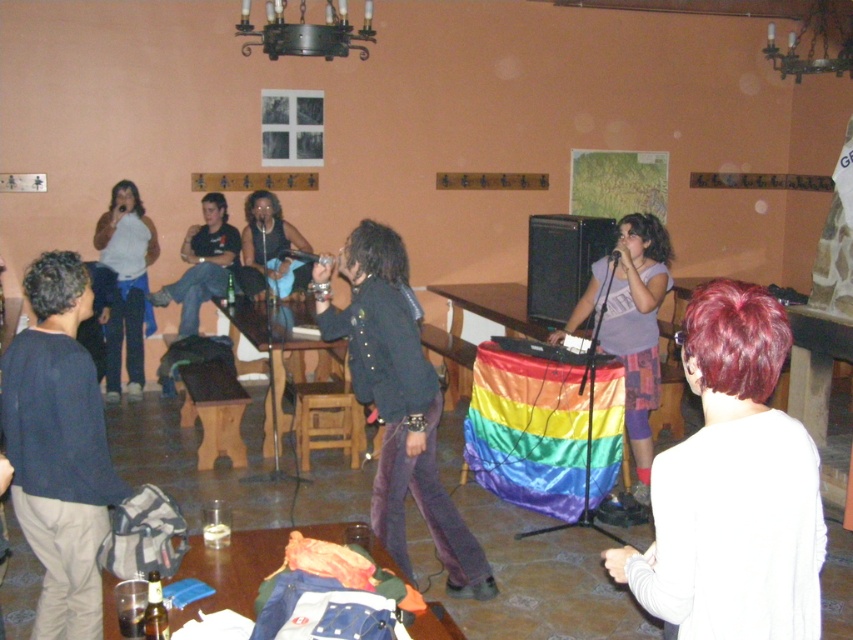
Question: Which point is farther to the camera?

Choices:
 (A) (631, 316)
 (B) (772, 538)
 (C) (51, 621)

Answer: (A)

Question: Which object appears farthest from the camera in this image?

Choices:
 (A) dark blue jeans at center
 (B) rainbow fabric dj booth at center
 (C) dark blue sweater at left

Answer: (A)

Question: Considering the relative positions of dark blue sweater at left and dark blue jeans at center in the image provided, where is dark blue sweater at left located with respect to dark blue jeans at center?

Choices:
 (A) above
 (B) below

Answer: (B)

Question: Is dark blue sweater at left smaller than velvet black jacket at center?

Choices:
 (A) yes
 (B) no

Answer: (A)

Question: Estimate the real-world distances between objects in this image. Which object is farther from the dark blue sweater at left?

Choices:
 (A) velvet black jacket at center
 (B) dark blue jeans at center
 (C) matte black jacket at left

Answer: (C)

Question: Does matte black jacket at left have a lesser width compared to dark blue jeans at center?

Choices:
 (A) no
 (B) yes

Answer: (B)